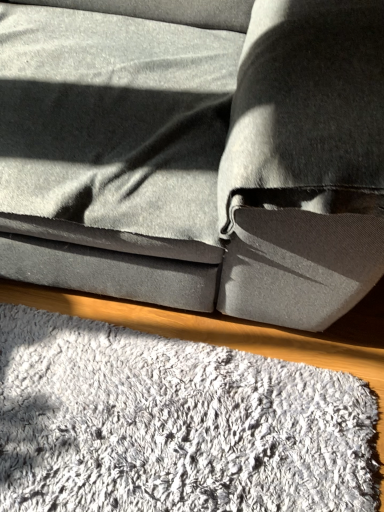
Question: In terms of width, does white fluffy mat at lower center look wider or thinner when compared to suede gray couch at center?

Choices:
 (A) thin
 (B) wide

Answer: (A)

Question: Considering the positions of white fluffy mat at lower center and suede gray couch at center in the image, is white fluffy mat at lower center taller or shorter than suede gray couch at center?

Choices:
 (A) short
 (B) tall

Answer: (A)

Question: Choose the correct answer: Is white fluffy mat at lower center inside suede gray couch at center or outside it?

Choices:
 (A) inside
 (B) outside

Answer: (B)

Question: Considering the positions of suede gray couch at center and white fluffy mat at lower center in the image, is suede gray couch at center bigger or smaller than white fluffy mat at lower center?

Choices:
 (A) small
 (B) big

Answer: (B)

Question: Is suede gray couch at center in front of or behind white fluffy mat at lower center in the image?

Choices:
 (A) behind
 (B) front

Answer: (B)

Question: From a real-world perspective, is suede gray couch at center physically located above or below white fluffy mat at lower center?

Choices:
 (A) above
 (B) below

Answer: (A)

Question: Is suede gray couch at center wider or thinner than white fluffy mat at lower center?

Choices:
 (A) wide
 (B) thin

Answer: (A)